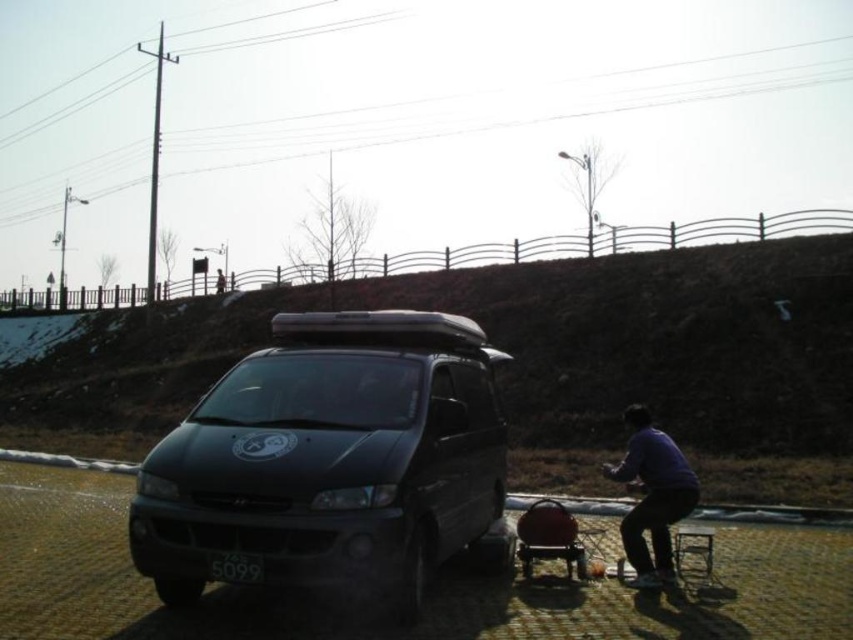
Does matte black van at center have a larger size compared to purple matte shirt at lower right?

Correct, matte black van at center is larger in size than purple matte shirt at lower right.

Which is in front, point (262, 444) or point (637, 481)?

Point (262, 444) is in front.

Is point (148, 570) closer to viewer compared to point (633, 579)?

Yes, it is in front of point (633, 579).

The image size is (853, 640). I want to click on matte black van at center, so click(331, 458).

Does matte black van at center have a greater height compared to black plastic license plate at center?

Yes.

Is matte black van at center above black plastic license plate at center?

Yes.

Locate an element on the screen. matte black van at center is located at coordinates (331, 458).

Who is more forward, (642, 465) or (248, 563)?

Point (248, 563) is in front.

Who is taller, purple matte shirt at lower right or black plastic license plate at center?

Standing taller between the two is purple matte shirt at lower right.

Find the location of a particular element. purple matte shirt at lower right is located at coordinates (653, 496).

Image resolution: width=853 pixels, height=640 pixels. What are the coordinates of `purple matte shirt at lower right` in the screenshot? It's located at (653, 496).